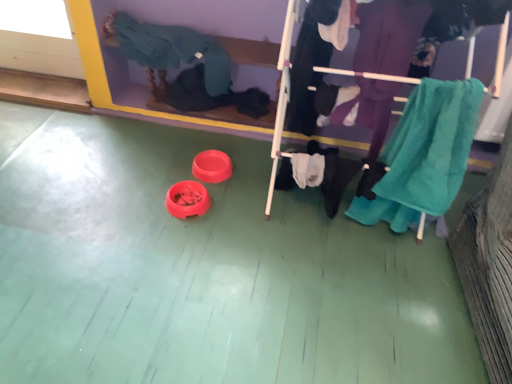
How much space does knitted teal sweater at upper left, which ranks as the 1th clothing in left-to-right order, occupy vertically?

knitted teal sweater at upper left, which ranks as the 1th clothing in left-to-right order, is 10.61 inches tall.

The height and width of the screenshot is (384, 512). What do you see at coordinates (424, 157) in the screenshot? I see `teal towel at right, the third clothing viewed from the left` at bounding box center [424, 157].

At what (x,y) coordinates should I click in order to perform the action: click on knitted teal sweater at upper left, the third clothing from the right. Please return your answer as a coordinate pair (x, y). Looking at the image, I should click on (170, 49).

Locate an element on the screen. This screenshot has height=384, width=512. the 1st clothing located beneath the knitted teal sweater at upper left, which ranks as the 1th clothing in left-to-right order (from a real-world perspective) is located at coordinates (424, 157).

Is teal towel at right, the first clothing positioned from the right, looking in the opposite direction of knitted teal sweater at upper left, which ranks as the 1th clothing in left-to-right order?

No, teal towel at right, the first clothing positioned from the right, is not facing away from knitted teal sweater at upper left, which ranks as the 1th clothing in left-to-right order.

Between point (448, 108) and point (192, 30), which one is positioned behind?

The point (192, 30) is behind.

Can you confirm if teal towel at right, the first clothing positioned from the right, is smaller than knitted teal sweater at upper left, which ranks as the 1th clothing in left-to-right order?

Yes.

From the image's perspective, between knitted teal sweater at upper left, the third clothing from the right, and black cotton pants at center, which is counted as the 2th clothing, starting from the left, which one is located above?

From the image's view, knitted teal sweater at upper left, the third clothing from the right, is above.

Is point (158, 57) positioned in front of point (319, 185)?

No.

Considering the sizes of objects knitted teal sweater at upper left, the third clothing from the right, and black cotton pants at center, marked as the 2th clothing in a right-to-left arrangement, in the image provided, who is taller, knitted teal sweater at upper left, the third clothing from the right, or black cotton pants at center, marked as the 2th clothing in a right-to-left arrangement,?

black cotton pants at center, marked as the 2th clothing in a right-to-left arrangement, is taller.

Could black cotton pants at center, which is counted as the 2th clothing, starting from the left, be considered to be inside knitted teal sweater at upper left, the third clothing from the right?

No.

Find the location of `furniture located on the left of teal towel at right, the first clothing positioned from the right`. furniture located on the left of teal towel at right, the first clothing positioned from the right is located at coordinates (282, 94).

Is teal fabric clothes rack at center not near teal towel at right, the third clothing viewed from the left?

No.

Is teal fabric clothes rack at center shorter than teal towel at right, the third clothing viewed from the left?

In fact, teal fabric clothes rack at center may be taller than teal towel at right, the third clothing viewed from the left.

Could you measure the distance between teal fabric clothes rack at center and teal towel at right, the first clothing positioned from the right?

teal fabric clothes rack at center is 11.12 inches from teal towel at right, the first clothing positioned from the right.

From a real-world perspective, who is located lower, black cotton pants at center, marked as the 2th clothing in a right-to-left arrangement, or teal fabric clothes rack at center?

black cotton pants at center, marked as the 2th clothing in a right-to-left arrangement, from a real-world perspective.

Considering the relative sizes of black cotton pants at center, which is counted as the 2th clothing, starting from the left, and teal fabric clothes rack at center in the image provided, is black cotton pants at center, which is counted as the 2th clothing, starting from the left, bigger than teal fabric clothes rack at center?

Actually, black cotton pants at center, which is counted as the 2th clothing, starting from the left, might be smaller than teal fabric clothes rack at center.

Choose the correct answer: Is black cotton pants at center, marked as the 2th clothing in a right-to-left arrangement, inside teal fabric clothes rack at center or outside it?

black cotton pants at center, marked as the 2th clothing in a right-to-left arrangement, is contained in teal fabric clothes rack at center.

Between black cotton pants at center, marked as the 2th clothing in a right-to-left arrangement, and teal fabric clothes rack at center, which one has less height?

black cotton pants at center, marked as the 2th clothing in a right-to-left arrangement, is shorter.

Measure the distance from teal towel at right, the first clothing positioned from the right, to teal fabric clothes rack at center.

They are 11.12 inches apart.

Looking at this image, from a real-world perspective, who is located lower, teal towel at right, the first clothing positioned from the right, or teal fabric clothes rack at center?

In real-world perspective, teal towel at right, the first clothing positioned from the right, is lower.

From the picture: Is teal towel at right, the third clothing viewed from the left, positioned far away from teal fabric clothes rack at center?

No, there isn't a large distance between teal towel at right, the third clothing viewed from the left, and teal fabric clothes rack at center.

What's the angular difference between teal towel at right, the first clothing positioned from the right, and teal fabric clothes rack at center's facing directions?

There is a 2.32e-05-degree angle between the facing directions of teal towel at right, the first clothing positioned from the right, and teal fabric clothes rack at center.

Considering the sizes of teal fabric clothes rack at center and knitted teal sweater at upper left, which ranks as the 1th clothing in left-to-right order, in the image, is teal fabric clothes rack at center taller or shorter than knitted teal sweater at upper left, which ranks as the 1th clothing in left-to-right order,?

Clearly, teal fabric clothes rack at center is taller compared to knitted teal sweater at upper left, which ranks as the 1th clothing in left-to-right order.

Which is behind, point (416, 83) or point (170, 61)?

Point (170, 61)

Would you say teal fabric clothes rack at center is inside or outside knitted teal sweater at upper left, the third clothing from the right?

teal fabric clothes rack at center is located beyond the bounds of knitted teal sweater at upper left, the third clothing from the right.

Considering the positions of objects teal fabric clothes rack at center and knitted teal sweater at upper left, which ranks as the 1th clothing in left-to-right order, in the image provided, who is more to the left, teal fabric clothes rack at center or knitted teal sweater at upper left, which ranks as the 1th clothing in left-to-right order,?

From the viewer's perspective, knitted teal sweater at upper left, which ranks as the 1th clothing in left-to-right order, appears more on the left side.

Could you measure the distance between knitted teal sweater at upper left, the third clothing from the right, and teal towel at right, the third clothing viewed from the left?

knitted teal sweater at upper left, the third clothing from the right, and teal towel at right, the third clothing viewed from the left, are 37.18 inches apart.

Considering the relative sizes of knitted teal sweater at upper left, which ranks as the 1th clothing in left-to-right order, and teal towel at right, the first clothing positioned from the right, in the image provided, is knitted teal sweater at upper left, which ranks as the 1th clothing in left-to-right order, bigger than teal towel at right, the first clothing positioned from the right,?

Indeed, knitted teal sweater at upper left, which ranks as the 1th clothing in left-to-right order, has a larger size compared to teal towel at right, the first clothing positioned from the right.

Is knitted teal sweater at upper left, the third clothing from the right, at the right side of teal towel at right, the third clothing viewed from the left?

Incorrect, knitted teal sweater at upper left, the third clothing from the right, is not on the right side of teal towel at right, the third clothing viewed from the left.

Is knitted teal sweater at upper left, which ranks as the 1th clothing in left-to-right order, taller or shorter than teal towel at right, the first clothing positioned from the right?

Clearly, knitted teal sweater at upper left, which ranks as the 1th clothing in left-to-right order, is shorter compared to teal towel at right, the first clothing positioned from the right.

From the teal towel at right, the first clothing positioned from the right, count 2nd clothings backward and point to it. Please provide its 2D coordinates.

[(170, 49)]

This screenshot has width=512, height=384. I want to click on clothing located on the left of black cotton pants at center, marked as the 2th clothing in a right-to-left arrangement, so click(170, 49).

Considering their positions, is teal fabric clothes rack at center positioned closer to black cotton pants at center, which is counted as the 2th clothing, starting from the left, than knitted teal sweater at upper left, the third clothing from the right?

teal fabric clothes rack at center is positioned closer to the anchor black cotton pants at center, which is counted as the 2th clothing, starting from the left.

Based on their spatial positions, is teal towel at right, the third clothing viewed from the left, or teal fabric clothes rack at center closer to black cotton pants at center, which is counted as the 2th clothing, starting from the left?

teal towel at right, the third clothing viewed from the left, lies closer to black cotton pants at center, which is counted as the 2th clothing, starting from the left, than the other object.

When comparing their distances from knitted teal sweater at upper left, which ranks as the 1th clothing in left-to-right order, does black cotton pants at center, which is counted as the 2th clothing, starting from the left, or teal fabric clothes rack at center seem closer?

teal fabric clothes rack at center.

Which object lies further to the anchor point teal fabric clothes rack at center, black cotton pants at center, which is counted as the 2th clothing, starting from the left, or knitted teal sweater at upper left, which ranks as the 1th clothing in left-to-right order?

Among the two, knitted teal sweater at upper left, which ranks as the 1th clothing in left-to-right order, is located further to teal fabric clothes rack at center.

Looking at this image, from the image, which object appears to be nearer to teal towel at right, the third clothing viewed from the left, knitted teal sweater at upper left, the third clothing from the right, or teal fabric clothes rack at center?

The object closer to teal towel at right, the third clothing viewed from the left, is teal fabric clothes rack at center.

Based on their spatial positions, is teal fabric clothes rack at center or knitted teal sweater at upper left, the third clothing from the right, further from teal towel at right, the third clothing viewed from the left?

knitted teal sweater at upper left, the third clothing from the right, is positioned further to the anchor teal towel at right, the third clothing viewed from the left.

In the scene shown: From the image, which object appears to be nearer to teal fabric clothes rack at center, teal towel at right, the third clothing viewed from the left, or knitted teal sweater at upper left, the third clothing from the right?

Based on the image, teal towel at right, the third clothing viewed from the left, appears to be nearer to teal fabric clothes rack at center.

Consider the image. Estimate the real-world distances between objects in this image. Which object is further from black cotton pants at center, marked as the 2th clothing in a right-to-left arrangement, knitted teal sweater at upper left, the third clothing from the right, or teal fabric clothes rack at center?

knitted teal sweater at upper left, the third clothing from the right, is further to black cotton pants at center, marked as the 2th clothing in a right-to-left arrangement.

The height and width of the screenshot is (384, 512). What are the coordinates of `clothing located between teal fabric clothes rack at center and black cotton pants at center, which is counted as the 2th clothing, starting from the left, in the depth direction` in the screenshot? It's located at (424, 157).

Identify the location of clothing situated between knitted teal sweater at upper left, the third clothing from the right, and teal fabric clothes rack at center from left to right. (332, 174).

Identify the location of furniture located between knitted teal sweater at upper left, which ranks as the 1th clothing in left-to-right order, and teal towel at right, the third clothing viewed from the left, in the left-right direction. (282, 94).

Image resolution: width=512 pixels, height=384 pixels. Identify the location of clothing between knitted teal sweater at upper left, which ranks as the 1th clothing in left-to-right order, and teal towel at right, the third clothing viewed from the left, in the horizontal direction. (332, 174).